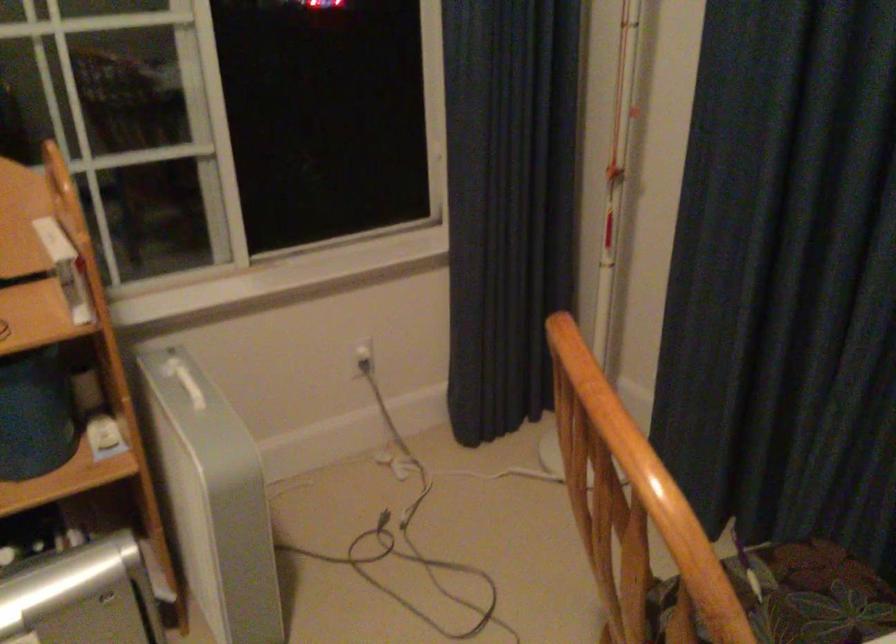
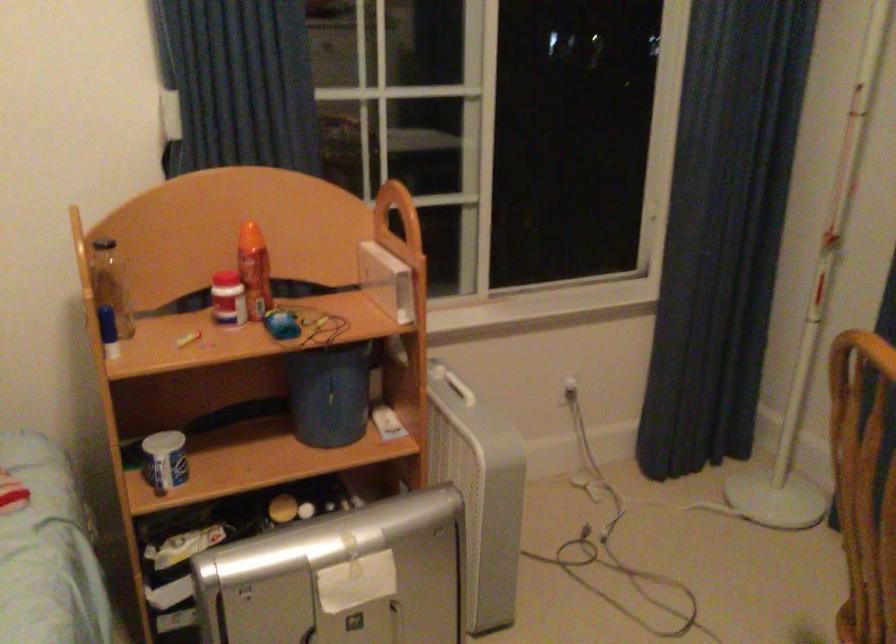
Where in the second image is the point corresponding to (x=591, y=504) from the first image?

(864, 484)